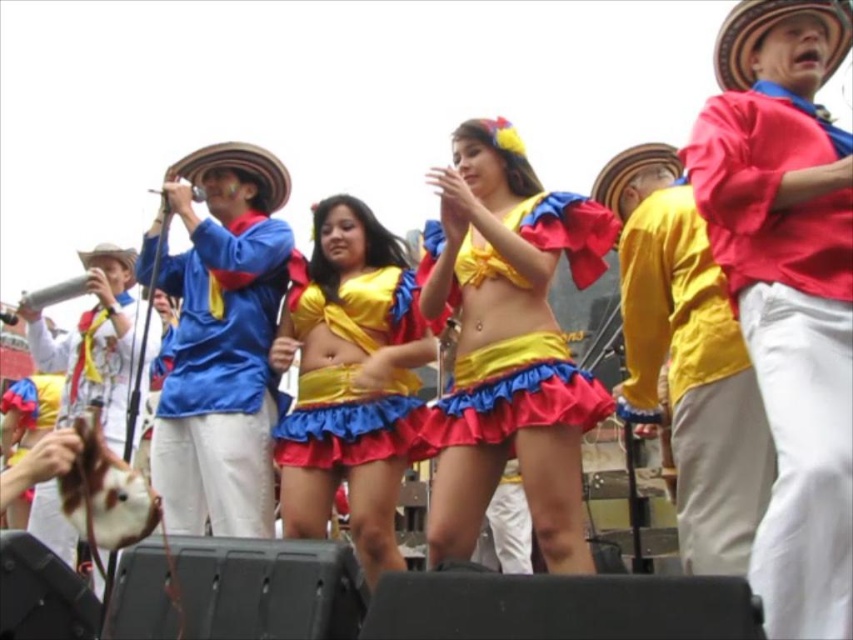
You are at a cultural event and want to locate the red cotton shirt at right. According to the coordinates provided, where would you look to find it?

The red cotton shirt at right is located at coordinates point [788,337].

You are attending this cultural event and want to take a photo of both the red cotton shirt at right and the yellow satin skirt at center. Which one should you focus on first if you want to capture their full details without cropping?

The red cotton shirt at right has a larger size compared to the yellow satin skirt at center, so you should focus on the red cotton shirt at right first to ensure its full details are captured without cropping.

You are a photographer at the event and want to capture a photo of both the shiny satin dress at center and the yellow satin skirt at center. Which one should you focus on first if you want to frame them from left to right?

The shiny satin dress at center is to the left of the yellow satin skirt at center, so you should focus on the shiny satin dress at center first to frame them from left to right.